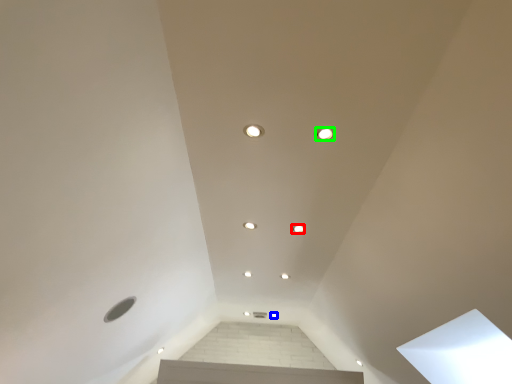
Question: Which object is positioned closest to dot (highlighted by a red box)? Select from dot (highlighted by a blue box) and dot (highlighted by a green box).

Choices:
 (A) dot
 (B) dot

Answer: (B)